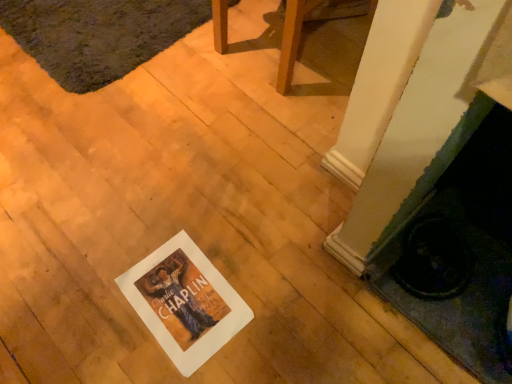
You are a GUI agent. You are given a task and a screenshot of the screen. Output one action in this format:
    pyautogui.click(x=<x>, y=<y>)
    Task: Click on the unoccupied area in front of dark gray shaggy rug at upper left
    Image resolution: width=512 pixels, height=384 pixels.
    Given the screenshot: What is the action you would take?
    (112, 133)